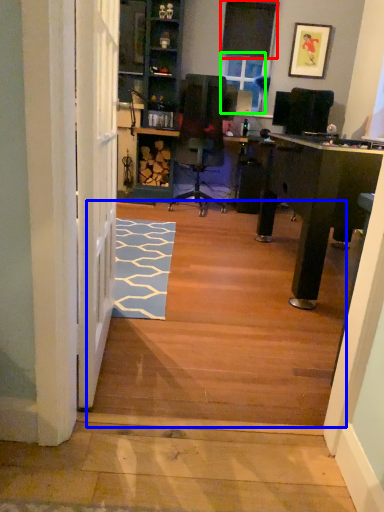
Question: Considering the real-world distances, which object is closest to window screen (highlighted by a red box)? stairwell (highlighted by a blue box) or window screen (highlighted by a green box).

Choices:
 (A) stairwell
 (B) window screen

Answer: (B)